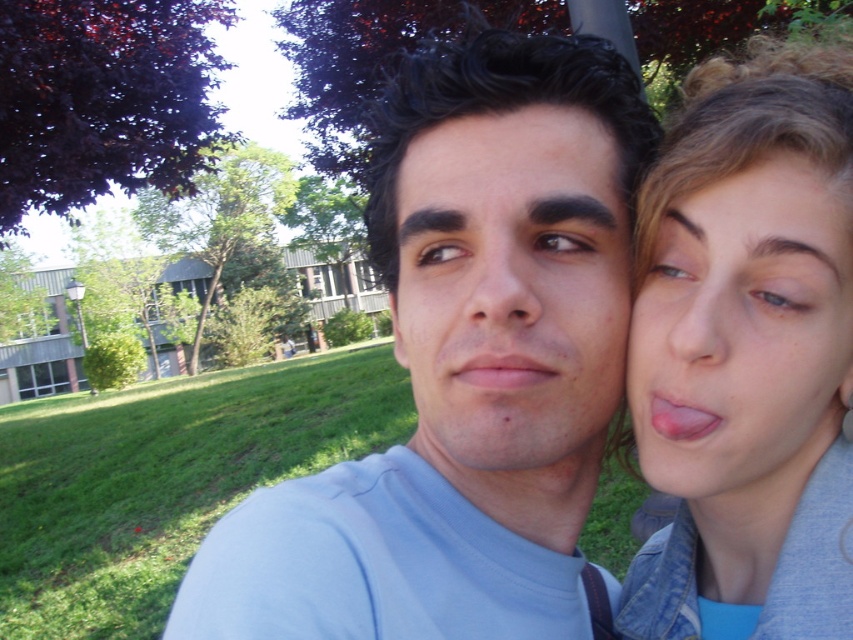
Looking at this image, you are standing in the park and see the two people in the image. The coordinates given are part of an object in the scene. Which object is located at point (747, 355)?

The point (747, 355) indicates the location of the matte gray jacket at right.